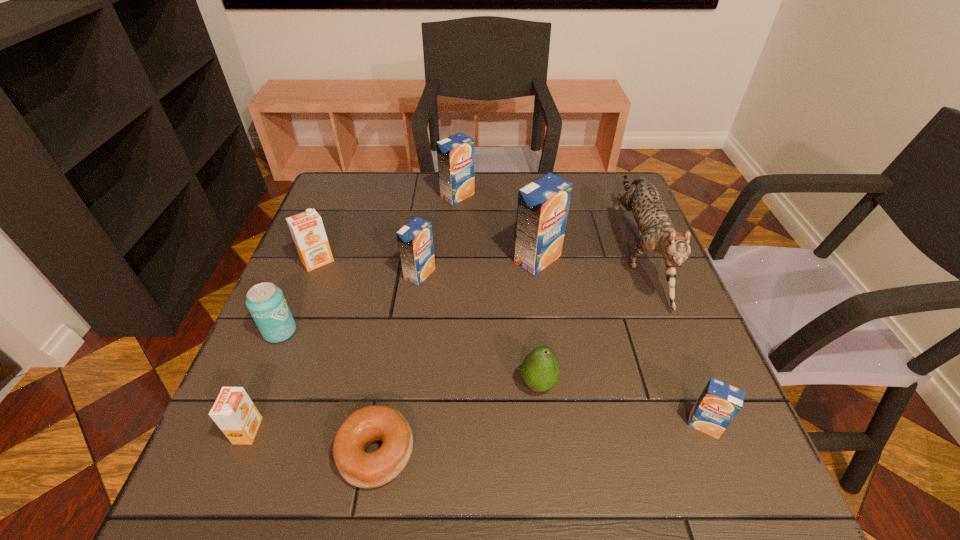
Where is `vacant space located 0.090m on the left of the avocado`? Image resolution: width=960 pixels, height=540 pixels. vacant space located 0.090m on the left of the avocado is located at coordinates (473, 384).

The height and width of the screenshot is (540, 960). In order to click on vacant space located 0.220m on the back of the nearest blue orange_juice in this screenshot , I will do `click(663, 320)`.

Where is `free region located on the front of the smaller orange orange juice`? The width and height of the screenshot is (960, 540). free region located on the front of the smaller orange orange juice is located at coordinates (224, 492).

At what (x,y) coordinates should I click in order to perform the action: click on vacant space located 0.350m on the right of the bagel. Please return your answer as a coordinate pair (x, y). Image resolution: width=960 pixels, height=540 pixels. Looking at the image, I should click on (617, 453).

I want to click on cat at the far edge, so click(x=656, y=232).

The image size is (960, 540). In order to click on orange_juice at the far edge in this screenshot , I will do `click(455, 154)`.

I want to click on object that is at the near edge, so click(x=376, y=423).

Image resolution: width=960 pixels, height=540 pixels. In order to click on beer can positioned at the left edge in this screenshot , I will do `click(266, 303)`.

At what (x,y) coordinates should I click in order to perform the action: click on cat that is at the right edge. Please return your answer as a coordinate pair (x, y). The height and width of the screenshot is (540, 960). Looking at the image, I should click on (656, 232).

The image size is (960, 540). Identify the location of orange_juice present at the right edge. (719, 403).